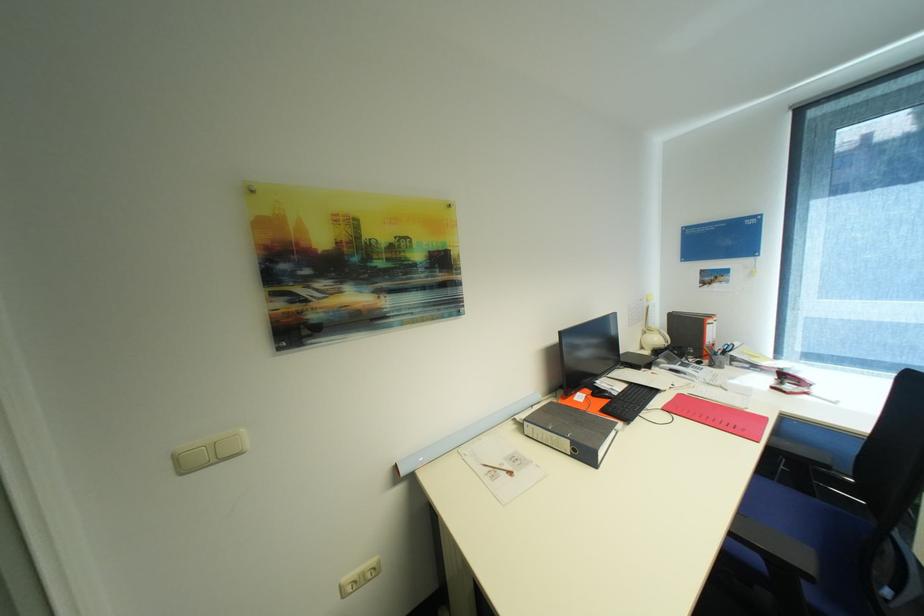
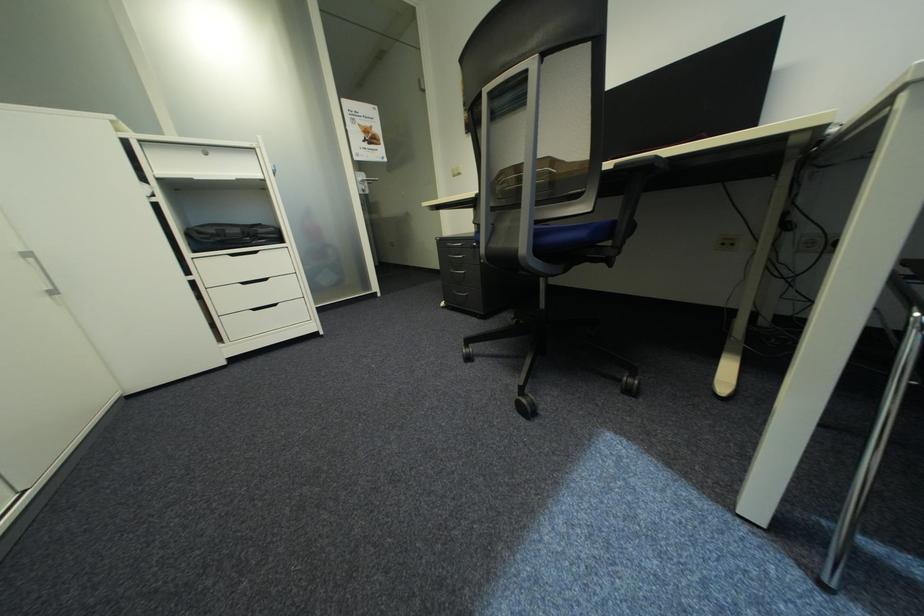
Question: I am providing you with two images of the same scene from different viewpoints. After the viewpoint changes to image2, which objects are now occluded?

Choices:
 (A) metal door handle
 (B) orange drink bottle
 (C) black keyboard
 (D) white cabinet handle

Answer: (C)